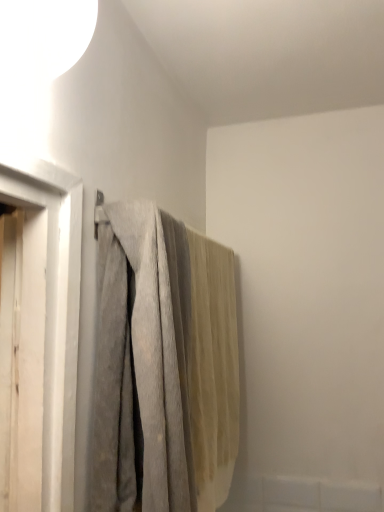
Question: Does white matte lampshade at upper left have a smaller size compared to gray textured fabric at center?

Choices:
 (A) no
 (B) yes

Answer: (B)

Question: From a real-world perspective, is white matte lampshade at upper left below gray textured fabric at center?

Choices:
 (A) no
 (B) yes

Answer: (A)

Question: Is white matte lampshade at upper left far away from gray textured fabric at center?

Choices:
 (A) no
 (B) yes

Answer: (A)

Question: Is white matte lampshade at upper left at the left side of gray textured fabric at center?

Choices:
 (A) yes
 (B) no

Answer: (A)

Question: Would you say gray textured fabric at center is part of white matte lampshade at upper left's contents?

Choices:
 (A) no
 (B) yes

Answer: (A)

Question: Can you see white matte lampshade at upper left touching gray textured fabric at center?

Choices:
 (A) yes
 (B) no

Answer: (B)

Question: Does gray textured fabric at center have a greater width compared to white matte lampshade at upper left?

Choices:
 (A) no
 (B) yes

Answer: (B)

Question: Would you say gray textured fabric at center is outside white matte lampshade at upper left?

Choices:
 (A) no
 (B) yes

Answer: (B)

Question: Is gray textured fabric at center turned away from white matte lampshade at upper left?

Choices:
 (A) yes
 (B) no

Answer: (B)

Question: From a real-world perspective, is gray textured fabric at center located higher than white matte lampshade at upper left?

Choices:
 (A) no
 (B) yes

Answer: (A)

Question: Is white matte lampshade at upper left a part of gray textured fabric at center?

Choices:
 (A) yes
 (B) no

Answer: (B)

Question: From the image's perspective, is gray textured fabric at center over white matte lampshade at upper left?

Choices:
 (A) yes
 (B) no

Answer: (B)

Question: From the image's perspective, relative to gray textured fabric at center, is white matte lampshade at upper left above or below?

Choices:
 (A) below
 (B) above

Answer: (B)